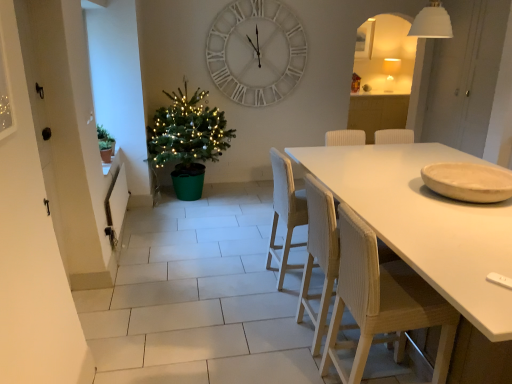
Question: From the image's perspective, is white woven chair at center, positioned as the 3th chair in front-to-back order, above or below wooden chair at lower right, the 1th chair positioned from the front?

Choices:
 (A) below
 (B) above

Answer: (B)

Question: From a real-world perspective, relative to wooden chair at lower right, arranged as the 3th chair when viewed from the back, is white woven chair at center, positioned as the 3th chair in front-to-back order, vertically above or below?

Choices:
 (A) below
 (B) above

Answer: (A)

Question: Which of these objects is positioned farthest from the beige matte plate at right?

Choices:
 (A) green matte plant at left
 (B) white matte table at center
 (C) green plastic christmas tree at left
 (D) matte white lampshade at upper right
 (E) white woven chair at center, marked as the 1th chair in a back-to-front arrangement

Answer: (D)

Question: Considering the real-world distances, which object is closest to the wooden chair at center, acting as the 2th chair starting from the front?

Choices:
 (A) beige matte plate at right
 (B) matte white lampshade at upper right
 (C) white woven chair at center, marked as the 1th chair in a back-to-front arrangement
 (D) white matte table at center
 (E) white matte wall clock at upper center

Answer: (C)